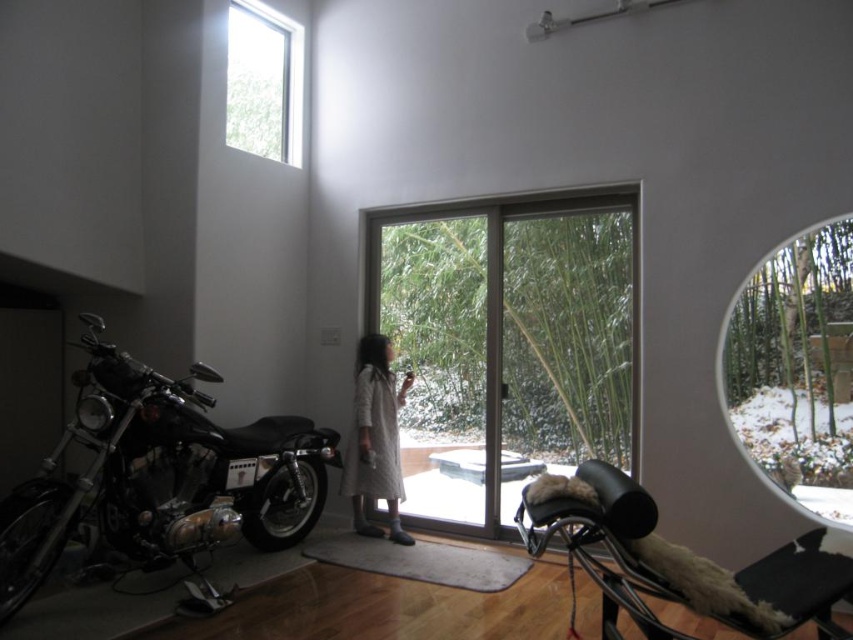
Is transparent glass window at upper right positioned in front of shiny chrome motorcycle at center?

No, transparent glass window at upper right is behind shiny chrome motorcycle at center.

Is point (810, 500) less distant than point (764, 582)?

No, (810, 500) is behind (764, 582).

Describe the element at coordinates (798, 369) in the screenshot. I see `transparent glass window at upper right` at that location.

Identify the location of transparent glass window at upper right. (798, 369).

Is clear glass screen door at center positioned at the back of shiny chrome motorcycle at center?

Yes, it is.

Which is in front, point (608, 420) or point (824, 554)?

Point (824, 554) is more forward.

This screenshot has width=853, height=640. I want to click on clear glass screen door at center, so click(x=508, y=344).

Between shiny chrome motorcycle at center and clear glass window at upper left, which one is positioned higher?

clear glass window at upper left is above.

Is shiny chrome motorcycle at center to the right of clear glass window at upper left from the viewer's perspective?

Yes, shiny chrome motorcycle at center is to the right of clear glass window at upper left.

Between point (821, 554) and point (288, 40), which one is positioned in front?

Point (821, 554)

Where is `shiny chrome motorcycle at center`? Image resolution: width=853 pixels, height=640 pixels. shiny chrome motorcycle at center is located at coordinates (679, 561).